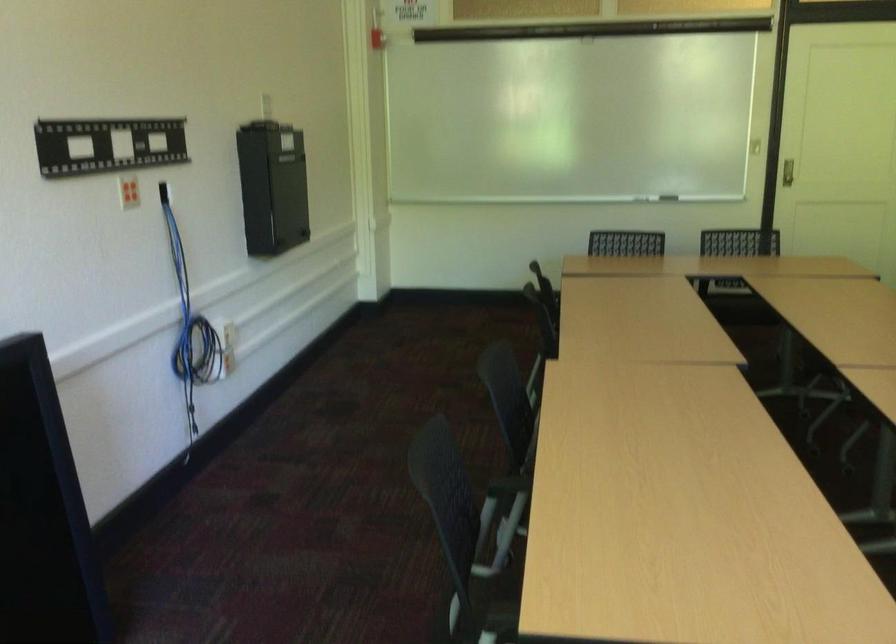
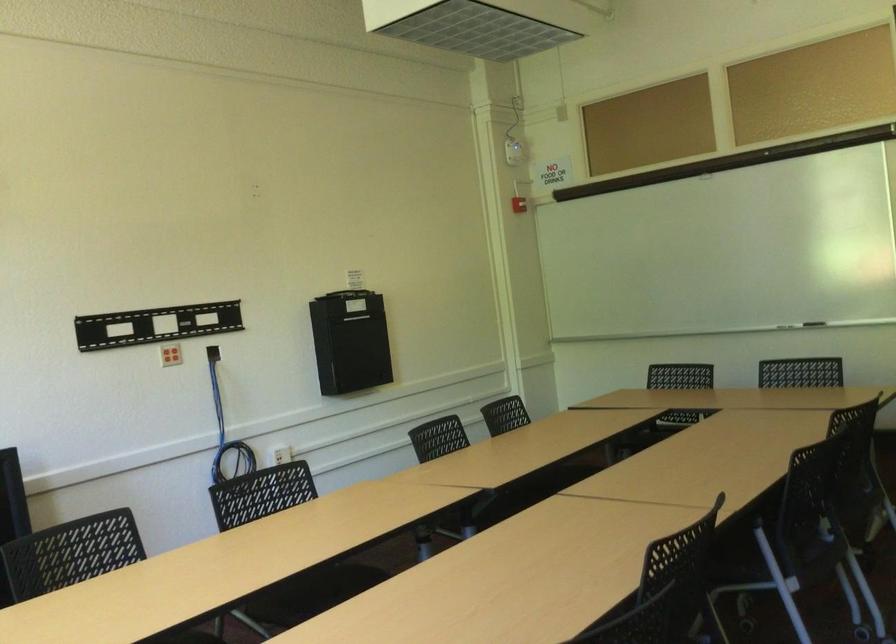
The point at (692, 185) is marked in the first image. Where is the corresponding point in the second image?

(814, 323)